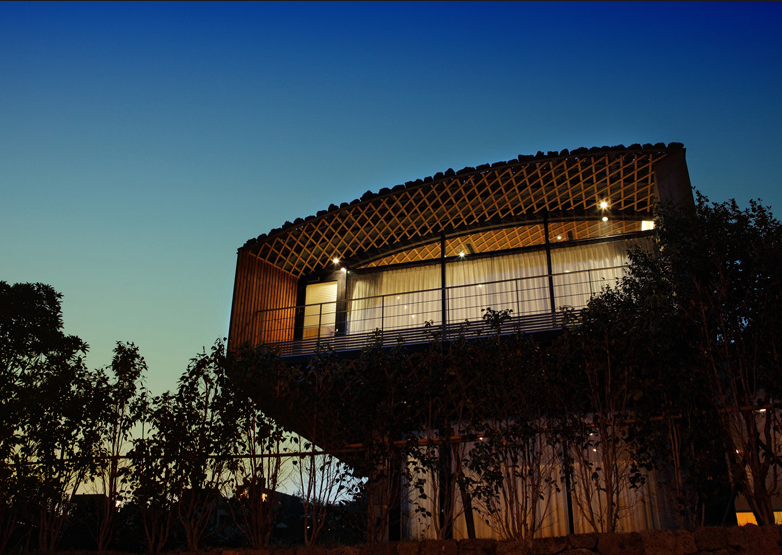
This screenshot has height=555, width=782. In order to click on window in this screenshot , I will do tap(503, 239), tap(407, 258), tap(586, 230).